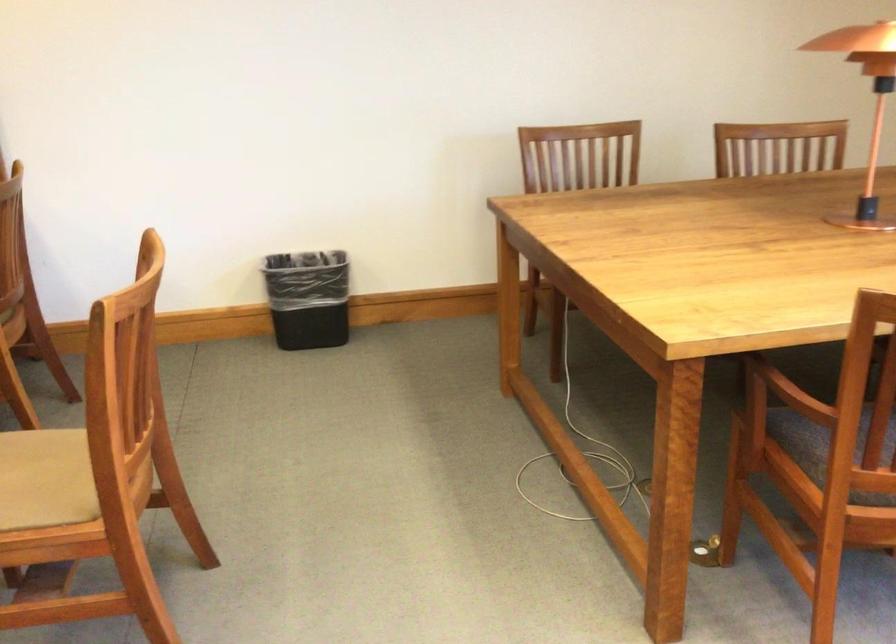
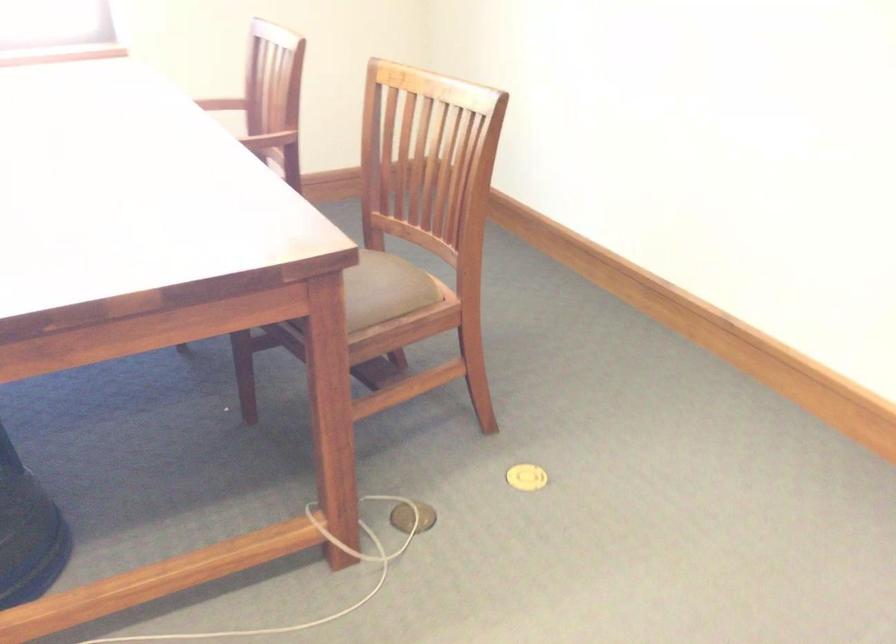
First-person continuous shooting, in which direction is the camera rotating?

The camera's rotation is toward right-down.